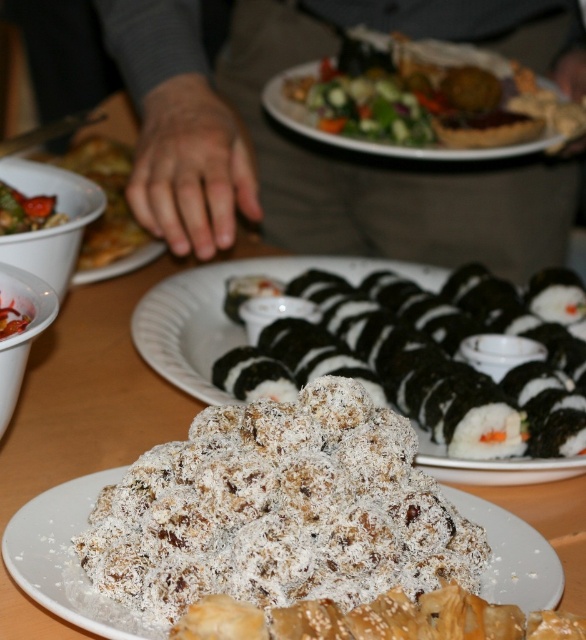
You are a food critic sitting at the dining table. You want to reach for the black seaweed sushi at center and the matte white bowl at upper left. Which item is closer to you based on their positions?

The black seaweed sushi at center is closer to you because it is located below the matte white bowl at upper left, meaning it is positioned lower and nearer in the visual hierarchy.

You are a food critic who needs to take a photo of the black seaweed sushi at center and the green leafy salad at upper center. Which one should you zoom in more on to capture the details of the food?

The black seaweed sushi at center has a smaller width compared to the green leafy salad at upper center, so you should zoom in more on the black seaweed sushi at center to capture its details.

You are a food critic evaluating the presentation of dishes on the table. The black seaweed sushi at center and the matte white bowl at upper left are part of the setup. Based on their sizes, which one do you think is more likely to dominate the visual focus of the arrangement?

The black seaweed sushi at center is larger than the matte white bowl at upper left, making it more likely to dominate the visual focus of the arrangement.